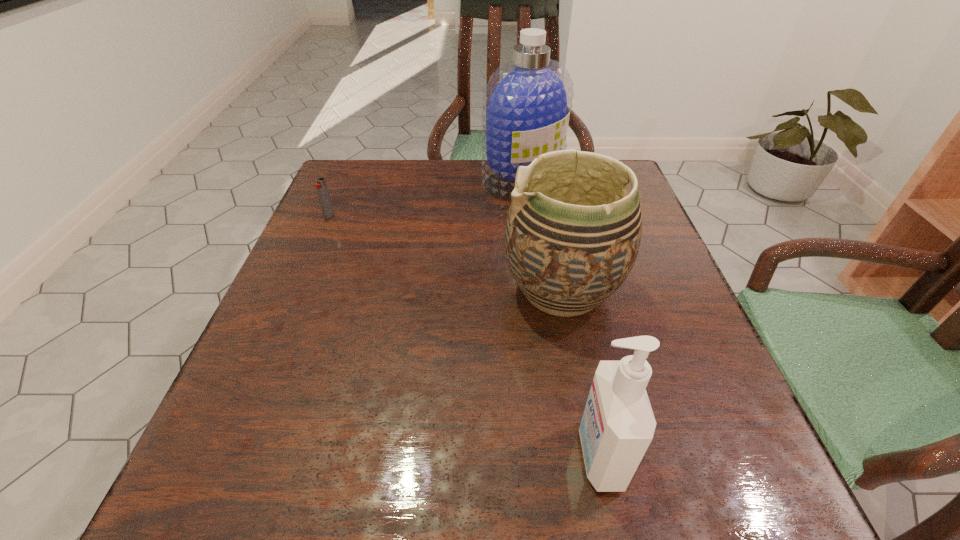
What are the coordinates of `vacant space at the right edge` in the screenshot? It's located at (663, 329).

I want to click on vacant space at the near right corner, so click(743, 503).

The image size is (960, 540). I want to click on free space between the shortest object and the nearest object, so click(x=464, y=335).

Locate an element on the screen. Image resolution: width=960 pixels, height=540 pixels. free space between the nearer cleansing agent and the farthest object is located at coordinates (561, 318).

Locate an element on the screen. The height and width of the screenshot is (540, 960). free space between the shortest object and the shorter cleansing agent is located at coordinates (464, 335).

Where is `free space between the taller cleansing agent and the leftmost object`? Image resolution: width=960 pixels, height=540 pixels. free space between the taller cleansing agent and the leftmost object is located at coordinates (425, 198).

The width and height of the screenshot is (960, 540). I want to click on free space between the farther cleansing agent and the nearer cleansing agent, so click(x=561, y=318).

Where is `free space between the leftmost object and the nearer cleansing agent`? free space between the leftmost object and the nearer cleansing agent is located at coordinates (464, 335).

The width and height of the screenshot is (960, 540). Identify the location of empty location between the nearer cleansing agent and the second nearest object. (581, 373).

The image size is (960, 540). Identify the location of free space between the second farthest object and the farthest object. (425, 198).